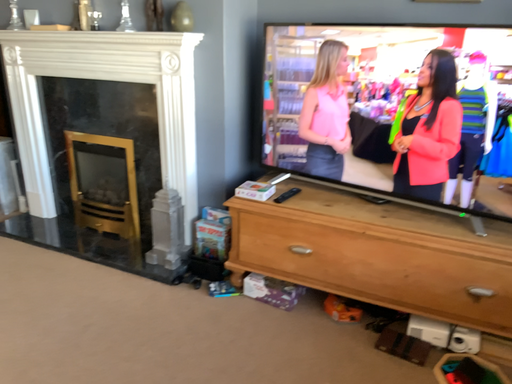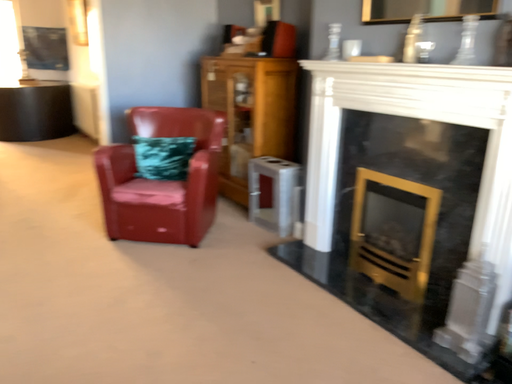
Question: How did the camera likely rotate when shooting the video?

Choices:
 (A) rotated left
 (B) rotated right

Answer: (A)